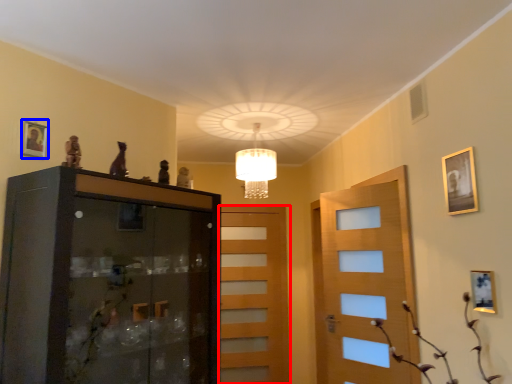
Question: Among these objects, which one is nearest to the camera, door (highlighted by a red box) or picture frame (highlighted by a blue box)?

Choices:
 (A) door
 (B) picture frame

Answer: (B)